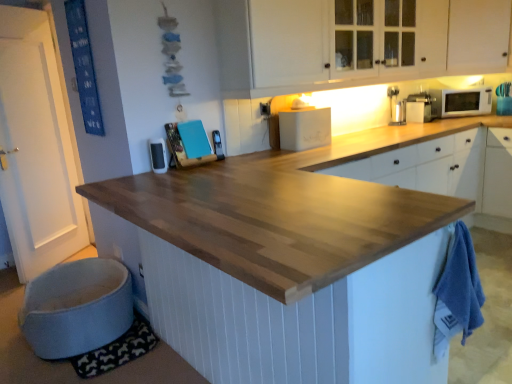
Find the location of a particular element. spots to the right of white glossy microwave at upper center, which is counted as the fourth appliance, starting from the right is located at coordinates (189, 163).